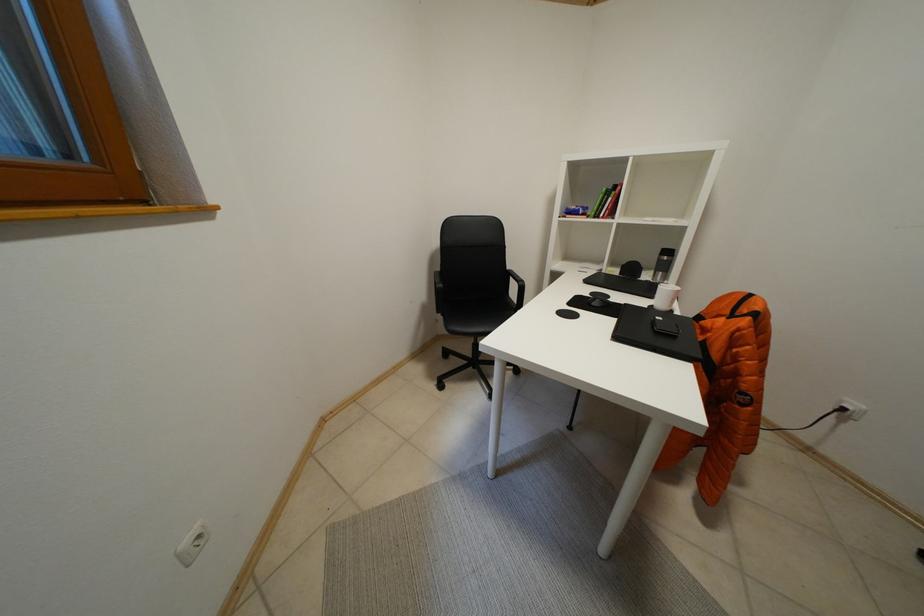
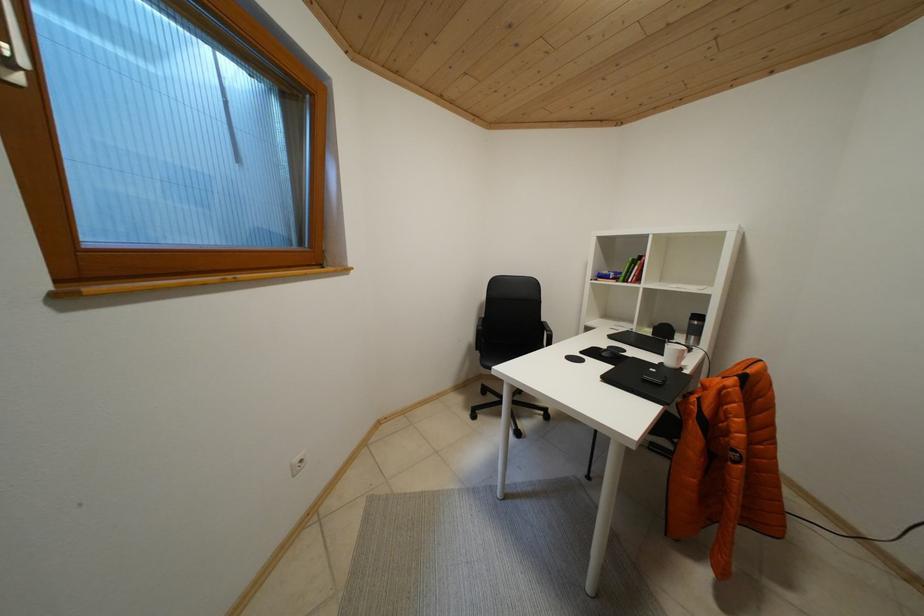
Question: The images are taken continuously from a first-person perspective. In which direction is your viewpoint rotating?

Choices:
 (A) Left
 (B) Right
 (C) Up
 (D) Down

Answer: (A)